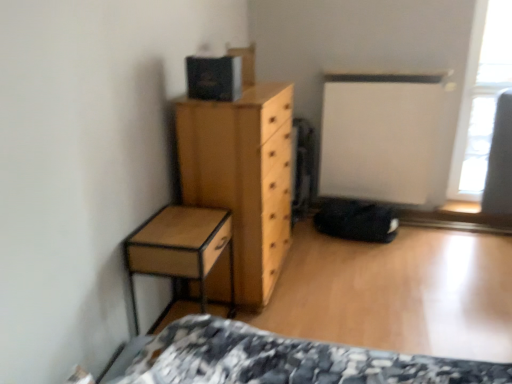
Question: Do you think light brown wood chest of drawers at center is within transparent glass window at upper right, or outside of it?

Choices:
 (A) inside
 (B) outside

Answer: (B)

Question: Is point (281, 152) positioned closer to the camera than point (497, 54)?

Choices:
 (A) closer
 (B) farther

Answer: (A)

Question: Estimate the real-world distances between objects in this image. Which object is farther from the light brown wood chest of drawers at center?

Choices:
 (A) transparent glass window at upper right
 (B) wooden nightstand at left

Answer: (A)

Question: Estimate the real-world distances between objects in this image. Which object is farther from the transparent glass window at upper right?

Choices:
 (A) light brown wood chest of drawers at center
 (B) wooden nightstand at left

Answer: (B)